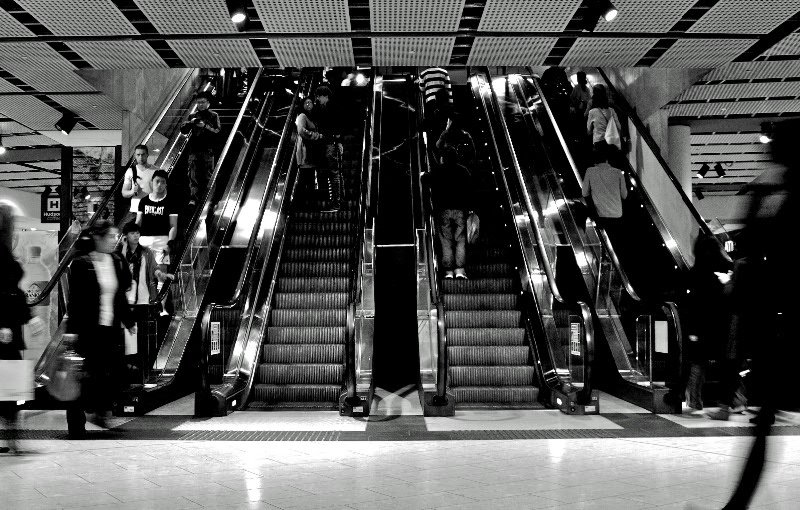
Where is `handrail`? handrail is located at coordinates (373, 288).